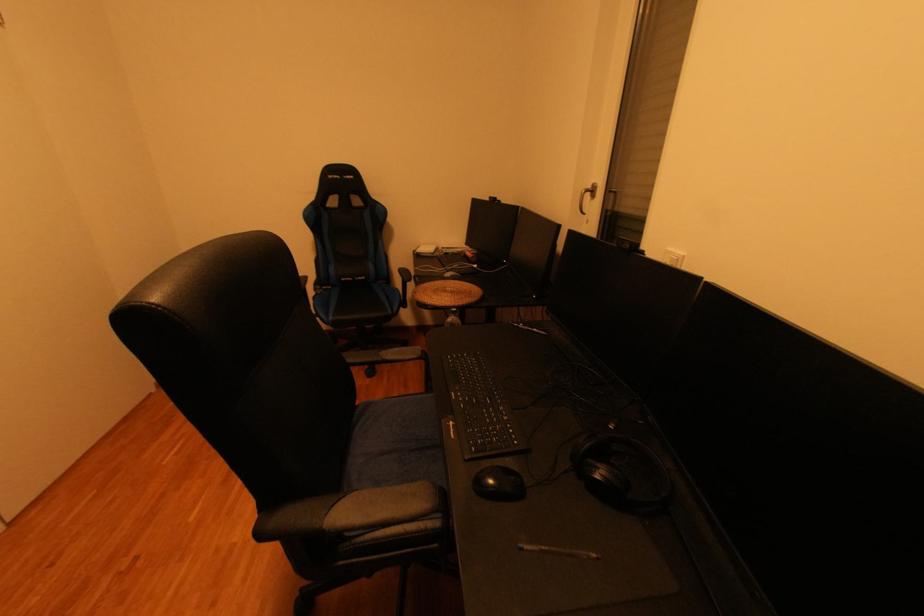
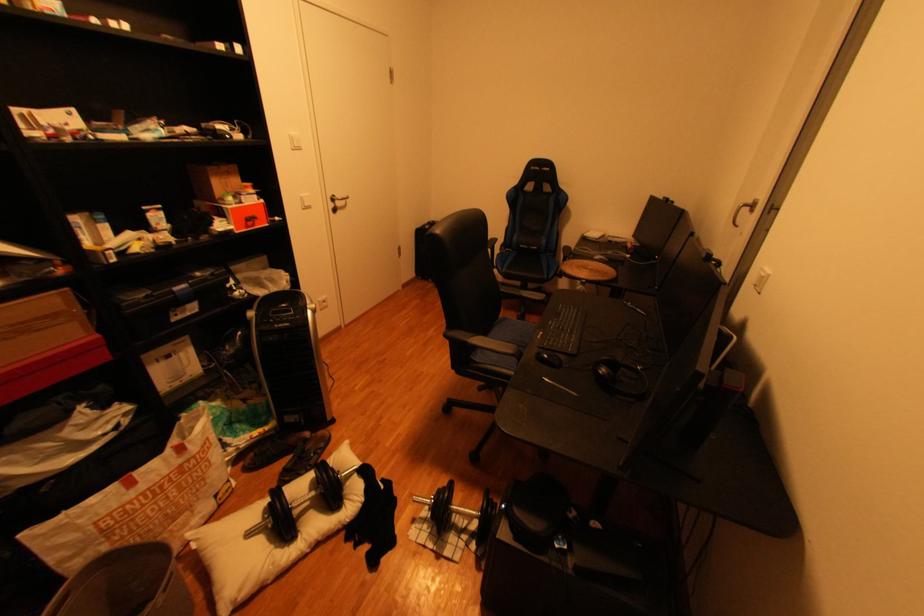
The point at (353, 280) is marked in the first image. Where is the corresponding point in the second image?

(531, 246)